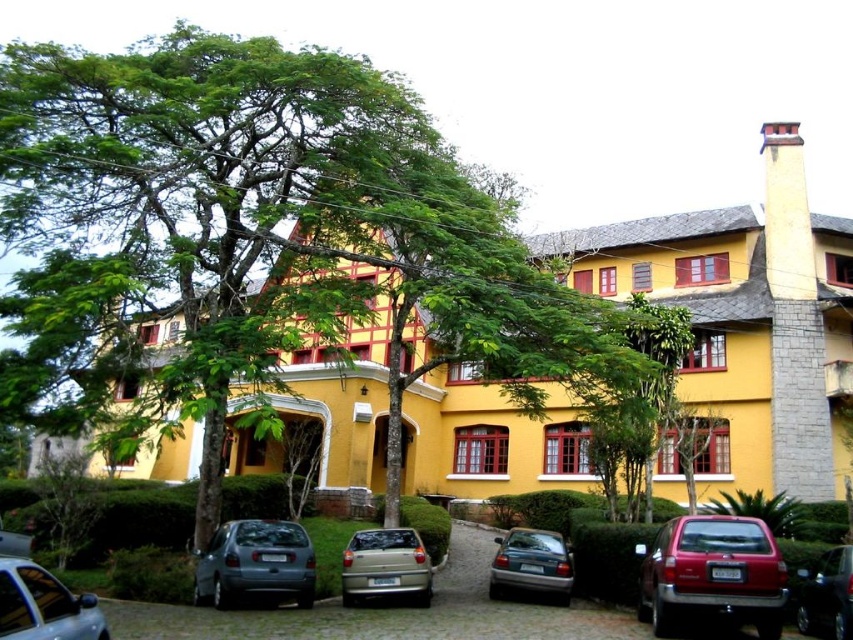
Question: Which point appears closest to the camera in this image?

Choices:
 (A) (509, 541)
 (B) (827, 563)

Answer: (B)

Question: Can you confirm if green leafy tree at center is positioned below shiny red suv at lower right?

Choices:
 (A) no
 (B) yes

Answer: (A)

Question: Which point appears farthest from the camera in this image?

Choices:
 (A) (227, 564)
 (B) (10, 605)

Answer: (A)

Question: Can you confirm if metallic gray car at center is wider than shiny black sedan at lower right?

Choices:
 (A) yes
 (B) no

Answer: (A)

Question: Is metallic gray car at center below metallic gray sedan at lower left?

Choices:
 (A) no
 (B) yes

Answer: (B)

Question: Which point is closer to the camera?

Choices:
 (A) teal metallic sedan at center
 (B) matte gray hatchback at lower left
 (C) metallic gold car at center

Answer: (B)